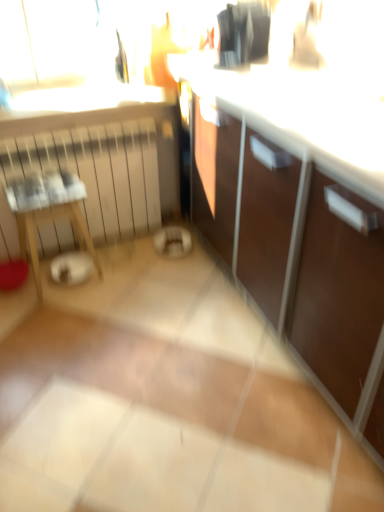
Question: Considering the relative sizes of black glossy coffee maker at upper center and clear glass window sill at upper center in the image provided, is black glossy coffee maker at upper center shorter than clear glass window sill at upper center?

Choices:
 (A) yes
 (B) no

Answer: (B)

Question: Does black glossy coffee maker at upper center lie behind clear glass window sill at upper center?

Choices:
 (A) yes
 (B) no

Answer: (B)

Question: Is black glossy coffee maker at upper center facing towards clear glass window sill at upper center?

Choices:
 (A) yes
 (B) no

Answer: (B)

Question: From the image's perspective, is black glossy coffee maker at upper center below clear glass window sill at upper center?

Choices:
 (A) yes
 (B) no

Answer: (B)

Question: Is black glossy coffee maker at upper center next to clear glass window sill at upper center?

Choices:
 (A) no
 (B) yes

Answer: (A)

Question: Is black glossy coffee maker at upper center not near clear glass window sill at upper center?

Choices:
 (A) yes
 (B) no

Answer: (B)

Question: Is wooden table at left completely or partially inside white matte radiator at left?

Choices:
 (A) yes
 (B) no

Answer: (B)

Question: Considering the relative positions of white matte radiator at left and wooden table at left in the image provided, is white matte radiator at left behind wooden table at left?

Choices:
 (A) no
 (B) yes

Answer: (B)

Question: Is white matte radiator at left directly adjacent to wooden table at left?

Choices:
 (A) yes
 (B) no

Answer: (B)

Question: Is white matte radiator at left closer to camera compared to wooden table at left?

Choices:
 (A) no
 (B) yes

Answer: (A)

Question: From the image's perspective, is white matte radiator at left below wooden table at left?

Choices:
 (A) yes
 (B) no

Answer: (B)

Question: Is white matte radiator at left oriented away from wooden table at left?

Choices:
 (A) no
 (B) yes

Answer: (B)

Question: Can you confirm if wooden table at left is positioned to the right of black glossy coffee maker at upper center?

Choices:
 (A) no
 (B) yes

Answer: (A)